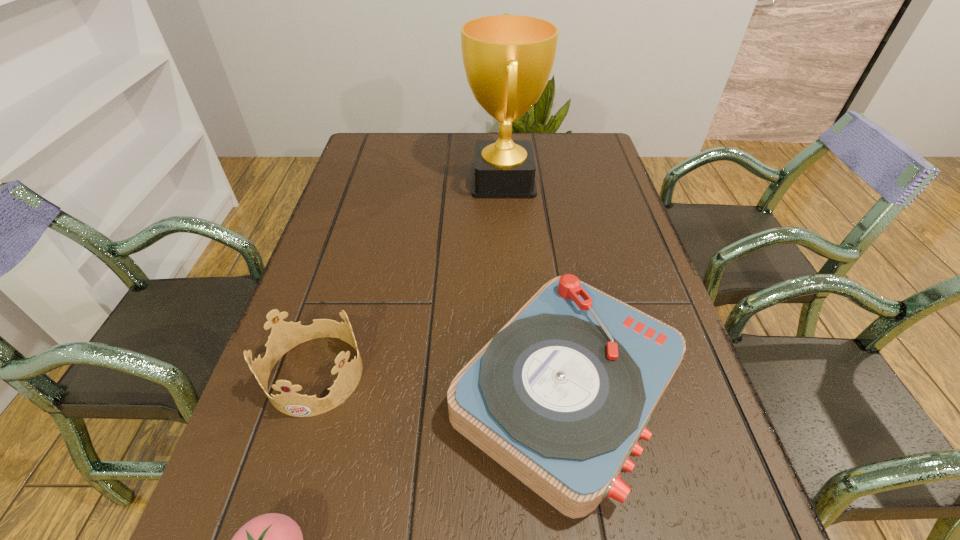
Where is `the tallest object`? the tallest object is located at coordinates (508, 59).

Identify the location of award. The width and height of the screenshot is (960, 540). coord(508,59).

The image size is (960, 540). Identify the location of record player. (559, 397).

Identify the location of tiara. The image size is (960, 540). (x=284, y=336).

Find the location of `vacant space located 0.320m on the front-facing side of the tallest object`. vacant space located 0.320m on the front-facing side of the tallest object is located at coordinates (358, 180).

Locate an element on the screen. The width and height of the screenshot is (960, 540). free space located 0.240m on the front-facing side of the tallest object is located at coordinates (385, 180).

At what (x,y) coordinates should I click in order to perform the action: click on free space located on the front-facing side of the tallest object. Please return your answer as a coordinate pair (x, y). The height and width of the screenshot is (540, 960). Looking at the image, I should click on 421,180.

Where is `free space located 0.110m on the left of the record player`? The height and width of the screenshot is (540, 960). free space located 0.110m on the left of the record player is located at coordinates (392, 393).

Identify the location of blank area located on the front-facing side of the tiara. (275, 508).

I want to click on object located in the far edge section of the desktop, so click(x=508, y=59).